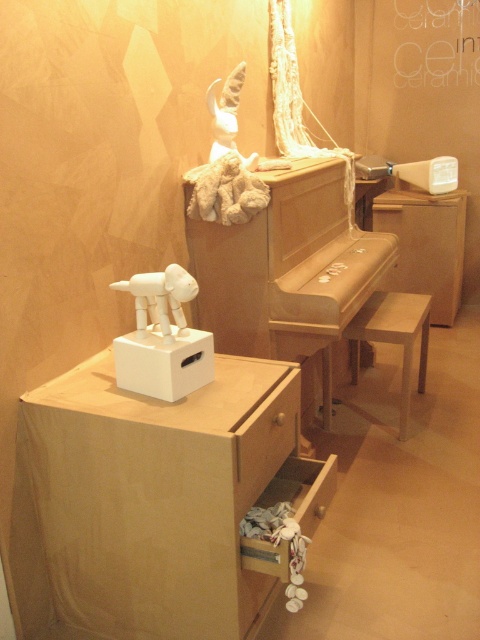
Is wooden drawer at lower center taller than white matte stool at center?

Incorrect, wooden drawer at lower center's height is not larger of white matte stool at center's.

Who is more forward, (x=295, y=368) or (x=408, y=412)?

Point (x=295, y=368) is in front.

This screenshot has width=480, height=640. Identify the location of wooden drawer at lower center. (265, 440).

Can you confirm if matte wood piano at center is shorter than white matte stool at center?

Incorrect, matte wood piano at center's height does not fall short of white matte stool at center's.

Is matte wood piano at center bigger than white matte stool at center?

Yes.

Measure the distance between matte wood piano at center and camera.

6.98 feet

Find the location of a particular element. This screenshot has height=640, width=480. matte wood piano at center is located at coordinates (288, 269).

Which is above, matte wood piano at center or wooden drawer at lower center?

matte wood piano at center

Between point (200, 241) and point (254, 484), which one is positioned in front?

Point (254, 484) is in front.

You are a GUI agent. You are given a task and a screenshot of the screen. Output one action in this format:
    pyautogui.click(x=<x>, y=<y>)
    Task: Click on the matte wood piano at center
    This screenshot has width=480, height=640.
    Given the screenshot: What is the action you would take?
    pyautogui.click(x=288, y=269)